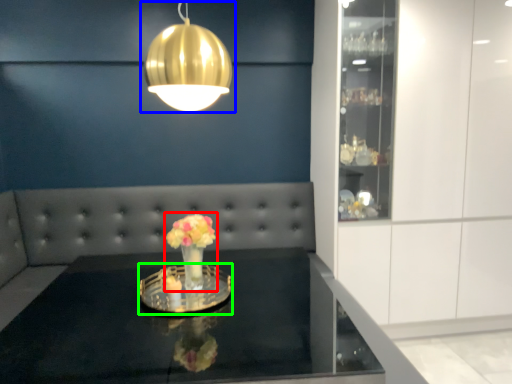
Question: Which object is the farthest from floral arrangement (highlighted by a red box)? Choose among these: lamp (highlighted by a blue box) or glass plate (highlighted by a green box).

Choices:
 (A) lamp
 (B) glass plate

Answer: (A)